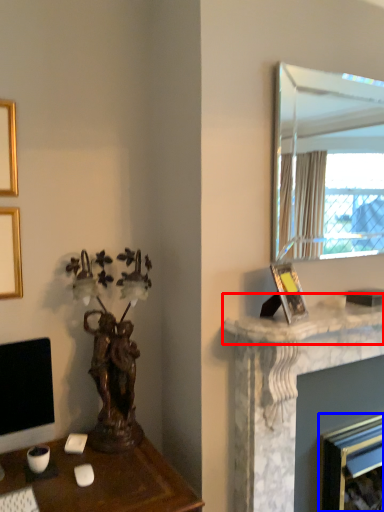
Question: Which of the following is the closest to the observer, counter top (highlighted by a red box) or fireplace (highlighted by a blue box)?

Choices:
 (A) counter top
 (B) fireplace

Answer: (A)